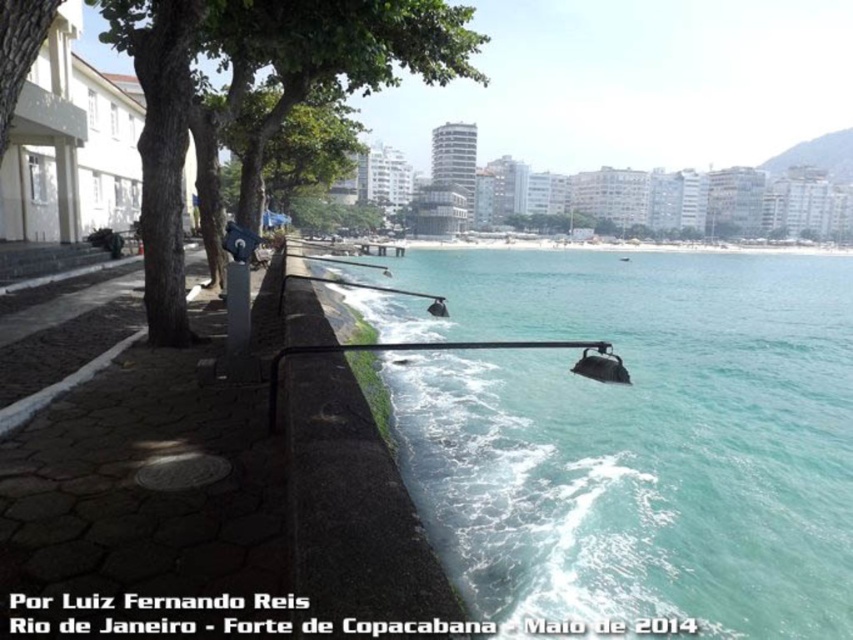
Which is behind, point (498, 372) or point (32, 3)?

The point (498, 372) is more distant.

Does clear blue water at lower center have a greater width compared to green leafy tree at upper left?

Indeed, clear blue water at lower center has a greater width compared to green leafy tree at upper left.

Is point (779, 376) positioned before point (21, 17)?

No, (779, 376) is behind (21, 17).

The image size is (853, 640). I want to click on clear blue water at lower center, so (x=633, y=436).

Between point (468, 532) and point (242, 100), which one is positioned in front?

Point (468, 532)

Is clear blue water at lower center wider than green leafy tree at upper center?

Correct, the width of clear blue water at lower center exceeds that of green leafy tree at upper center.

Where is `clear blue water at lower center`? The width and height of the screenshot is (853, 640). clear blue water at lower center is located at coordinates (633, 436).

Image resolution: width=853 pixels, height=640 pixels. I want to click on clear blue water at lower center, so click(633, 436).

Does clear blue water at lower center lie in front of green leafy tree at center?

Yes, it is in front of green leafy tree at center.

Based on the photo, is clear blue water at lower center taller than green leafy tree at center?

No, clear blue water at lower center is not taller than green leafy tree at center.

This screenshot has width=853, height=640. What do you see at coordinates (633, 436) in the screenshot?
I see `clear blue water at lower center` at bounding box center [633, 436].

Identify the location of clear blue water at lower center. This screenshot has height=640, width=853. point(633,436).